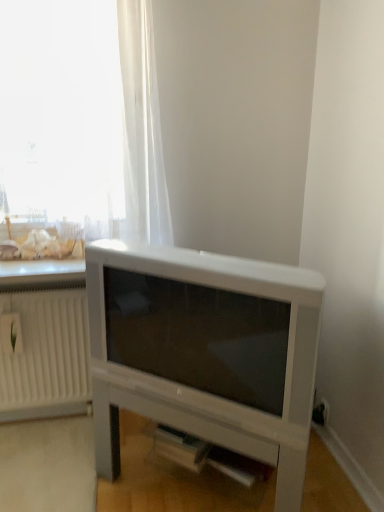
Question: Does transparent fabric at upper left have a greater width compared to white plastic radiator at left?

Choices:
 (A) yes
 (B) no

Answer: (A)

Question: From a real-world perspective, is transparent fabric at upper left on white plastic radiator at left?

Choices:
 (A) yes
 (B) no

Answer: (A)

Question: Does transparent fabric at upper left have a lesser height compared to white plastic radiator at left?

Choices:
 (A) no
 (B) yes

Answer: (A)

Question: Does transparent fabric at upper left come in front of white plastic radiator at left?

Choices:
 (A) no
 (B) yes

Answer: (B)

Question: Is transparent fabric at upper left positioned with its back to white plastic radiator at left?

Choices:
 (A) no
 (B) yes

Answer: (A)

Question: Is the depth of transparent fabric at upper left greater than that of white plastic radiator at left?

Choices:
 (A) yes
 (B) no

Answer: (B)

Question: Does white matte entertainment center at lower center appear on the left side of transparent fabric at upper left?

Choices:
 (A) yes
 (B) no

Answer: (B)

Question: From the image's perspective, is white matte entertainment center at lower center below transparent fabric at upper left?

Choices:
 (A) no
 (B) yes

Answer: (B)

Question: Considering the relative sizes of white matte entertainment center at lower center and transparent fabric at upper left in the image provided, is white matte entertainment center at lower center smaller than transparent fabric at upper left?

Choices:
 (A) no
 (B) yes

Answer: (A)

Question: Is white matte entertainment center at lower center oriented towards transparent fabric at upper left?

Choices:
 (A) yes
 (B) no

Answer: (B)

Question: Does white matte entertainment center at lower center have a lesser height compared to transparent fabric at upper left?

Choices:
 (A) no
 (B) yes

Answer: (B)

Question: Is white matte entertainment center at lower center far from transparent fabric at upper left?

Choices:
 (A) no
 (B) yes

Answer: (A)

Question: Does white plastic radiator at left have a larger size compared to transparent fabric at upper left?

Choices:
 (A) no
 (B) yes

Answer: (A)